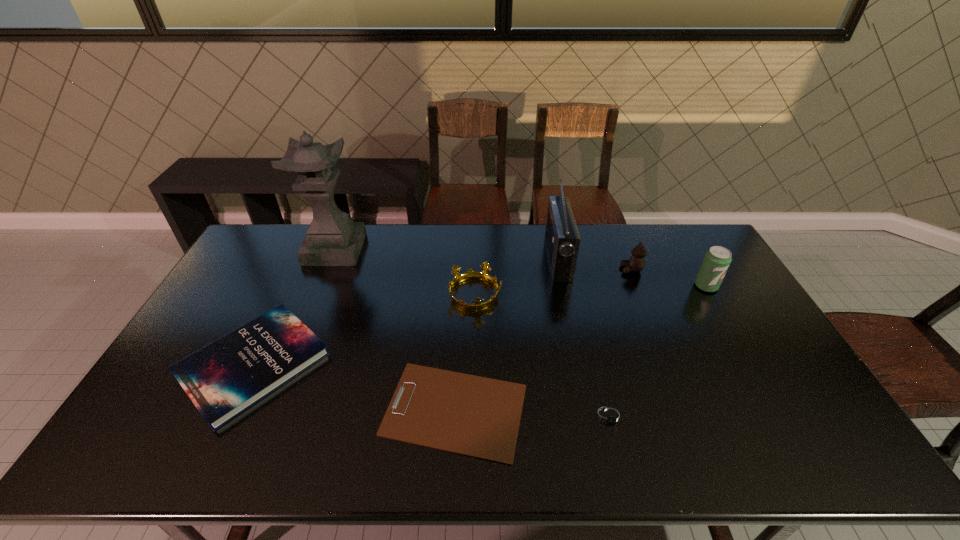
The width and height of the screenshot is (960, 540). Find the location of `vacant area situated at the front opening of the tallest object`. vacant area situated at the front opening of the tallest object is located at coordinates (389, 249).

Where is `free location located on the front-facing side of the radio receiver`? free location located on the front-facing side of the radio receiver is located at coordinates (450, 259).

Where is `blank space located on the front-facing side of the radio receiver`? blank space located on the front-facing side of the radio receiver is located at coordinates click(478, 259).

I want to click on free space located 0.130m on the front-facing side of the radio receiver, so click(x=512, y=259).

Where is `vacant position located on the left of the rightmost object`? vacant position located on the left of the rightmost object is located at coordinates click(670, 286).

The width and height of the screenshot is (960, 540). I want to click on free space located 0.190m on the face of the teddy bear, so (566, 269).

The height and width of the screenshot is (540, 960). Find the location of `free location located 0.180m on the face of the teddy bear`. free location located 0.180m on the face of the teddy bear is located at coordinates click(x=569, y=269).

At what (x,y) coordinates should I click in order to perform the action: click on vacant point located on the face of the teddy bear. Please return your answer as a coordinate pair (x, y). This screenshot has height=540, width=960. Looking at the image, I should click on (566, 269).

Identify the location of vacant area situated on the right of the crown. The image size is (960, 540). (539, 294).

You are a GUI agent. You are given a task and a screenshot of the screen. Output one action in this format:
    pyautogui.click(x=<x>, y=<y>)
    Task: Click on the vacant space located on the back of the hardback book
    The width and height of the screenshot is (960, 540).
    Given the screenshot: What is the action you would take?
    pyautogui.click(x=298, y=272)